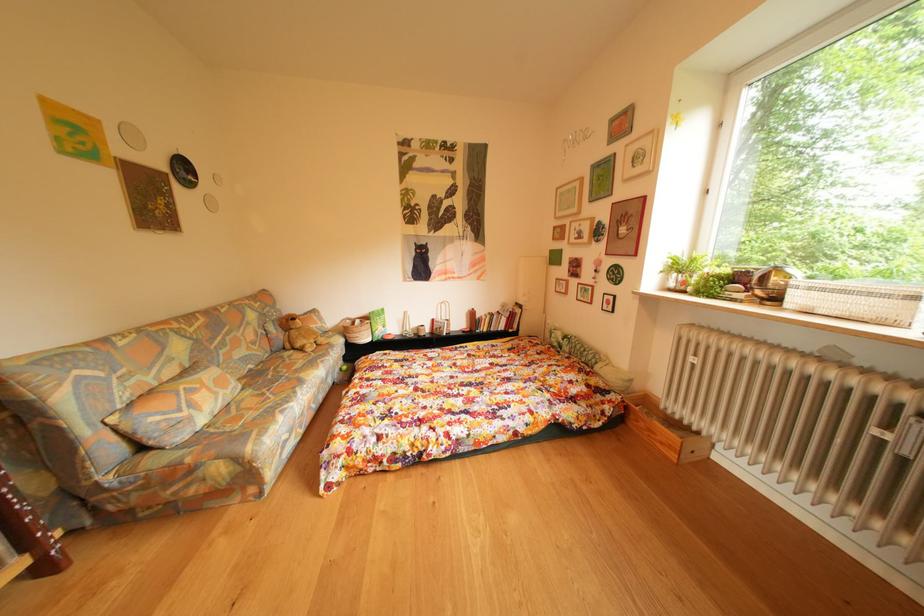
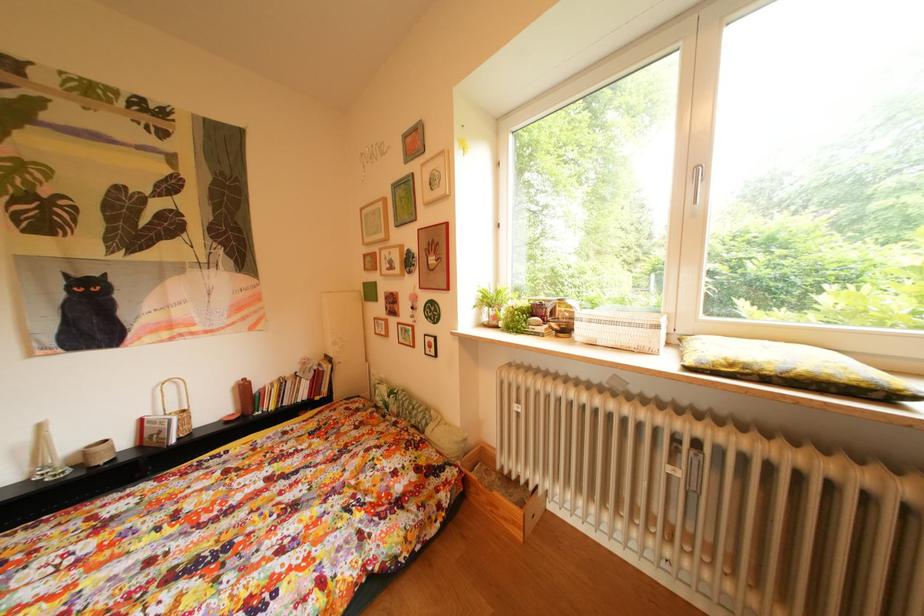
Question: The images are taken continuously from a first-person perspective. In which direction is your viewpoint rotating?

Choices:
 (A) Left
 (B) Right
 (C) Up
 (D) Down

Answer: (B)